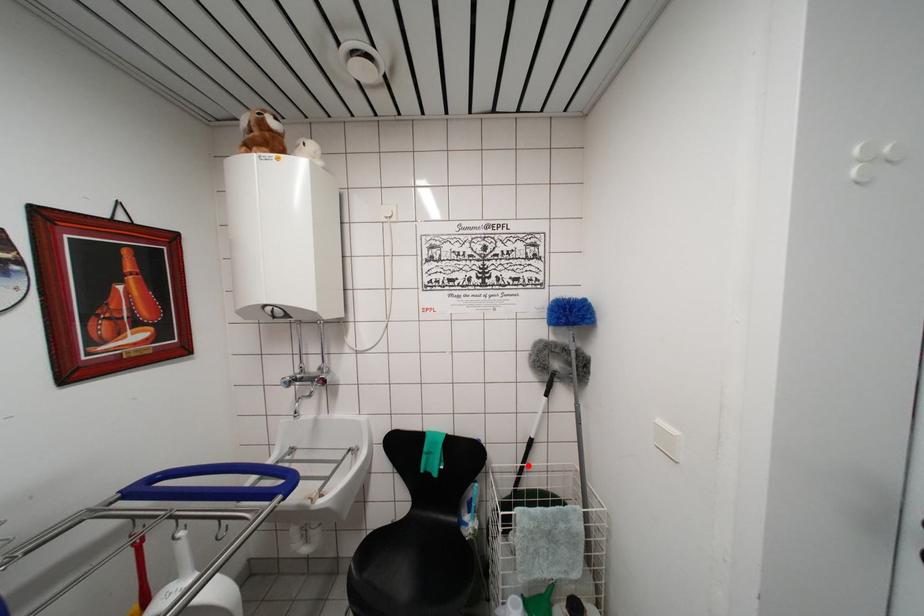
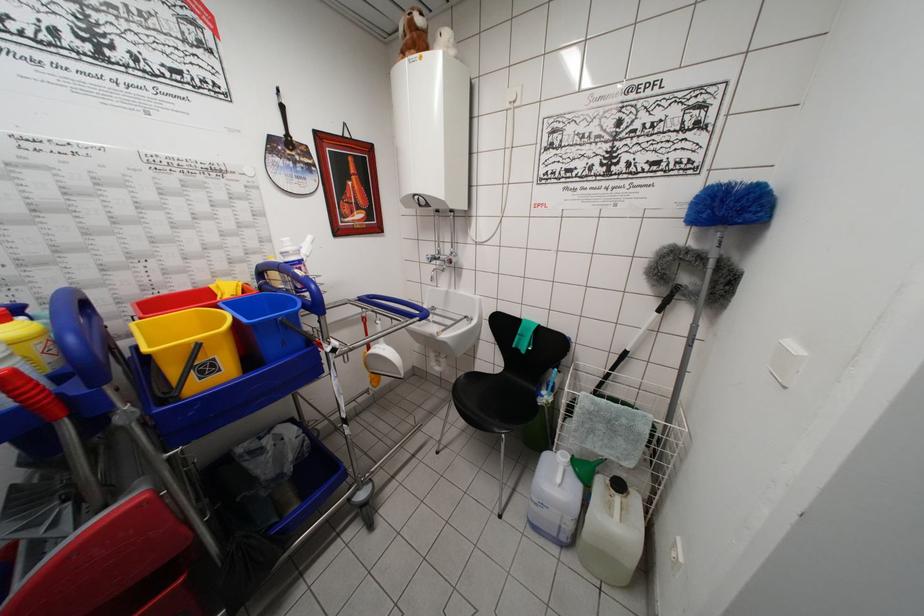
Question: I am providing you with two images of the same scene from different viewpoints. A red point is marked on the first image. Is the red point's position out of view in image 2?

Choices:
 (A) Yes
 (B) No

Answer: (B)